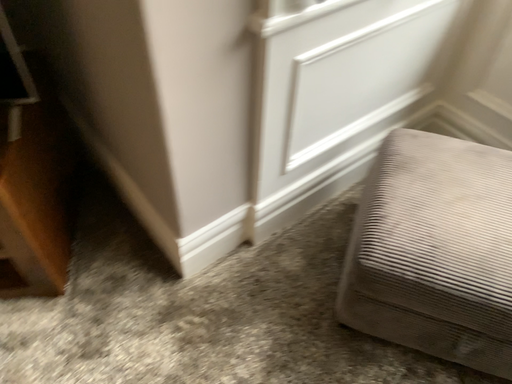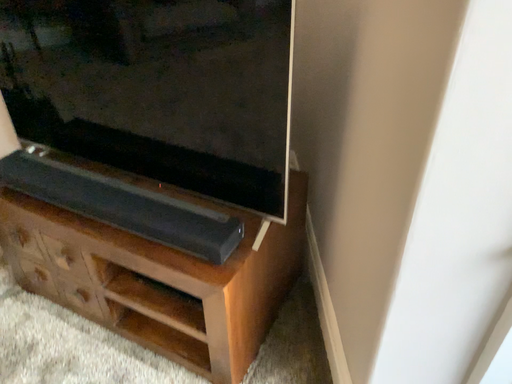
Question: Which way did the camera rotate in the video?

Choices:
 (A) rotated upward
 (B) rotated downward

Answer: (A)